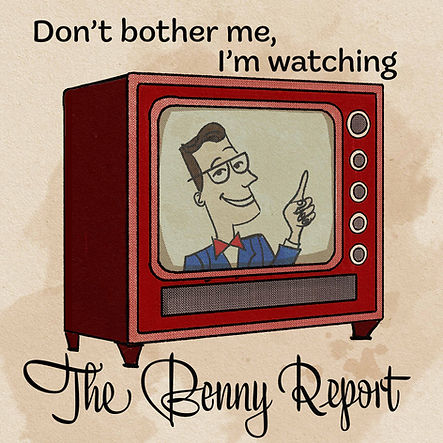
Identify the location of tv speaker. The image size is (443, 443). (222, 297).